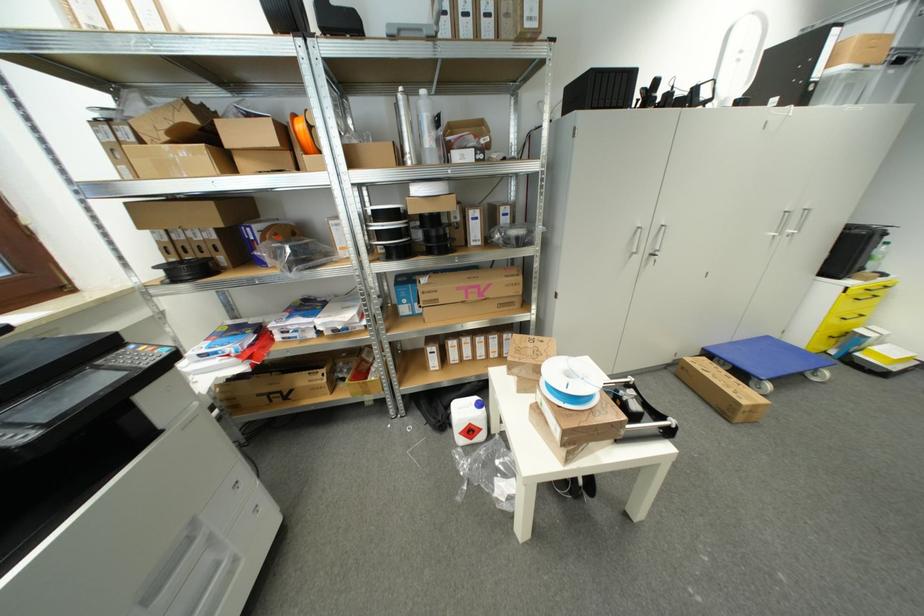
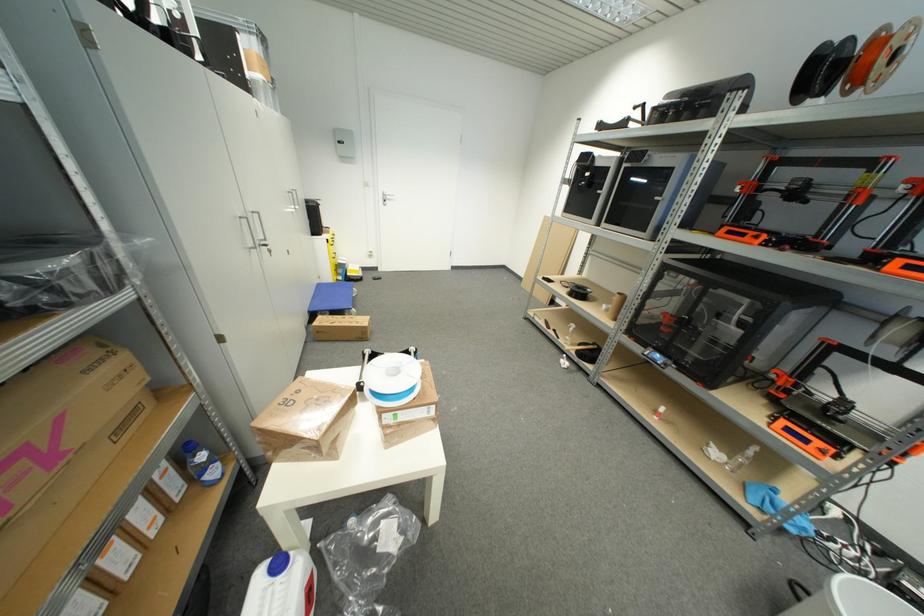
The images are taken continuously from a first-person perspective. In which direction is your viewpoint rotating?

The camera rotated toward right-down.